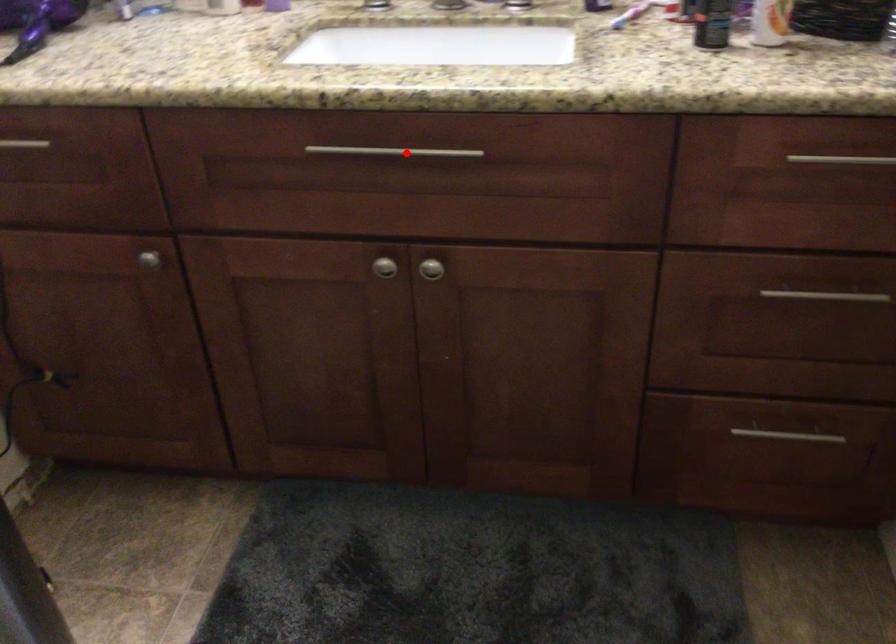
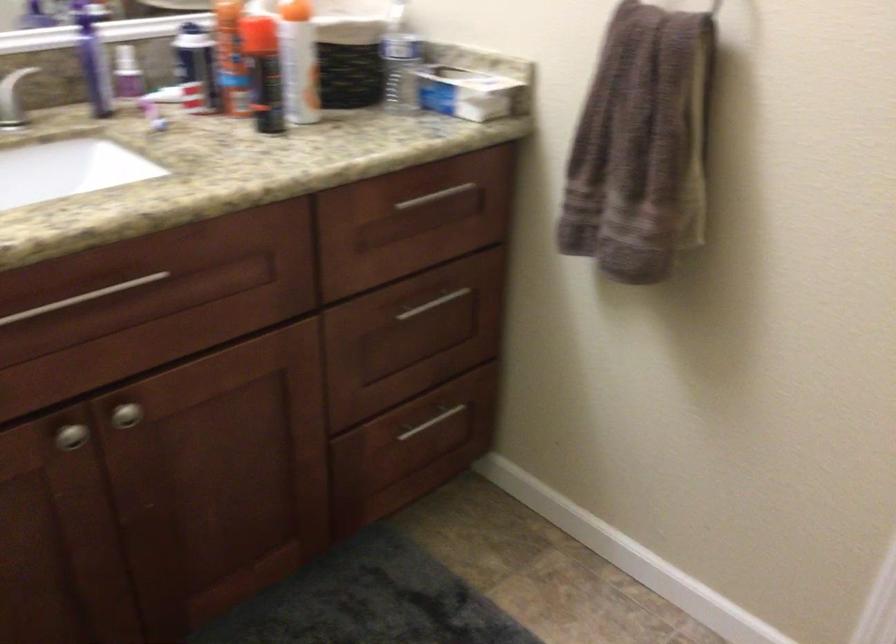
Question: A red point is marked in image1. In image2, is the corresponding 3D point closer to the camera or farther? Reply with the corresponding letter.

Choices:
 (A) The corresponding 3D point is closer.
 (B) The corresponding 3D point is farther.

Answer: (A)